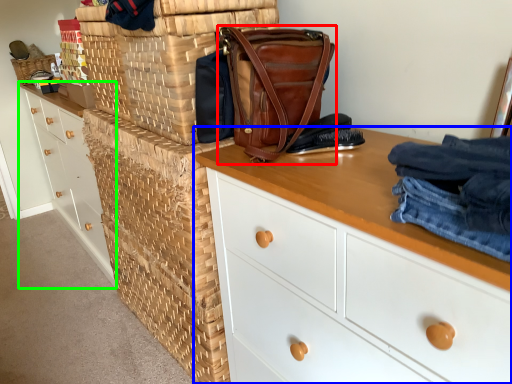
Question: Which object is the farthest from handbag (highlighted by a red box)? Choose among these: chest of drawers (highlighted by a blue box) or chest of drawers (highlighted by a green box).

Choices:
 (A) chest of drawers
 (B) chest of drawers

Answer: (B)